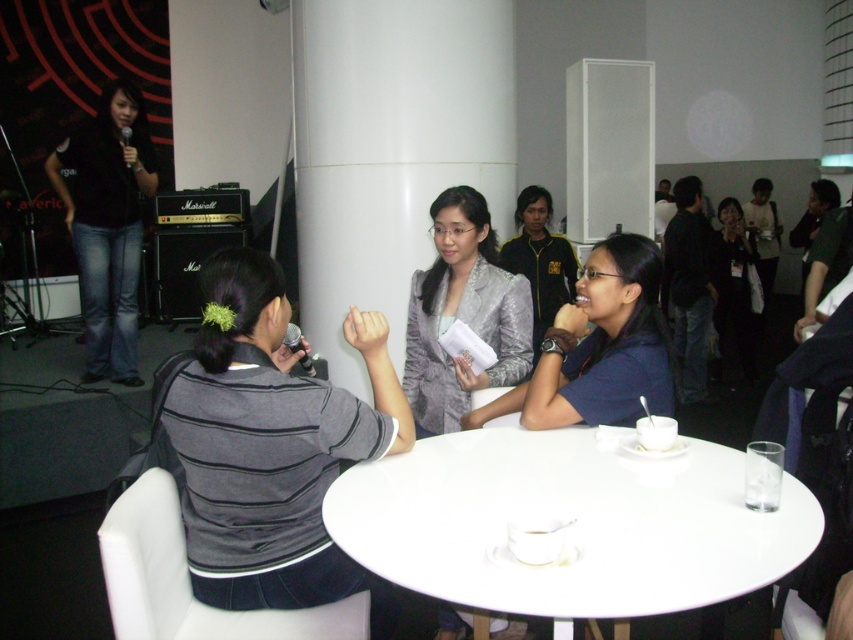
You are organizing a photo shoot and need to ensure the silver metallic blazer at center and black fabric shirt at center are visible in the frame. Based on their positions, which one is lower in the image?

The silver metallic blazer at center is located below the black fabric shirt at center, so it is lower in the image.

You are a photographer at the event and need to capture a closeup shot of the gray striped shirt at left and black denim jeans at left. From the description, which one is positioned lower in the image?

The gray striped shirt at left is located below black denim jeans at left, so the gray striped shirt at left is positioned lower in the image.